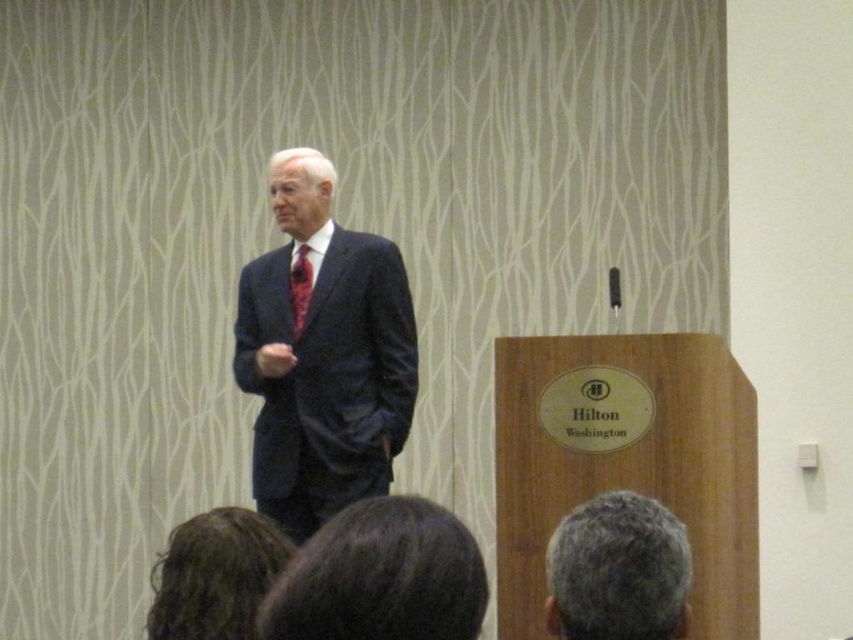
Between dark brown hair at lower center and shiny red tie at center, which one appears on the right side from the viewer's perspective?

dark brown hair at lower center

Is point (265, 618) less distant than point (300, 259)?

That is True.

Does point (432, 598) come farther from viewer compared to point (305, 280)?

No, it is not.

At what (x,y) coordinates should I click in order to perform the action: click on dark brown hair at lower center. Please return your answer as a coordinate pair (x, y). Looking at the image, I should click on (381, 577).

Based on the photo, can you confirm if dark blue suit at center is thinner than dark brown hair at lower center?

Incorrect, dark blue suit at center's width is not less than dark brown hair at lower center's.

Which is more to the left, dark blue suit at center or dark brown hair at lower center?

dark blue suit at center

Which is behind, point (350, 401) or point (427, 593)?

The point (350, 401) is more distant.

Where is `dark blue suit at center`? The height and width of the screenshot is (640, 853). dark blue suit at center is located at coordinates (323, 355).

Where is `dark blue suit at center`? The image size is (853, 640). dark blue suit at center is located at coordinates (323, 355).

Is point (381, 344) more distant than point (228, 628)?

Yes.

Measure the distance between point (315, 257) and camera.

Point (315, 257) and camera are 2.91 meters apart.

Where is `dark blue suit at center`? This screenshot has height=640, width=853. dark blue suit at center is located at coordinates 323,355.